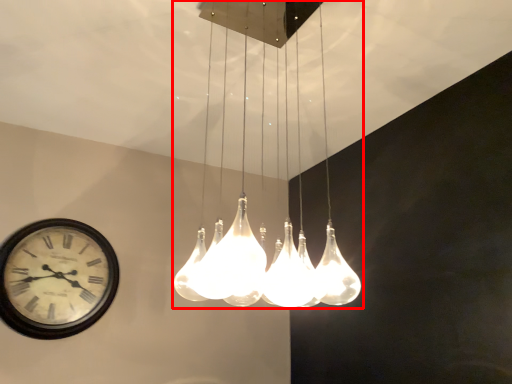
Question: Where is lamp (annotated by the red box) located in relation to wall clock in the image?

Choices:
 (A) left
 (B) right

Answer: (B)